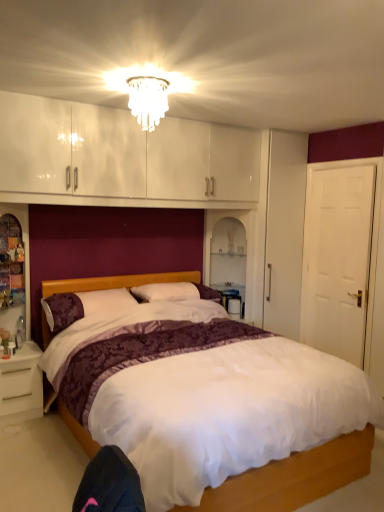
Question: From their relative heights in the image, would you say white glossy table at right is taller or shorter than translucent glass chandelier at upper center?

Choices:
 (A) short
 (B) tall

Answer: (B)

Question: Based on their positions, is white glossy table at right located to the left or right of translucent glass chandelier at upper center?

Choices:
 (A) left
 (B) right

Answer: (B)

Question: Which object is positioned farthest from the translucent glass chandelier at upper center?

Choices:
 (A) white glossy table at right
 (B) white matte door at right
 (C) white glossy nightstand at lower left
 (D) purple floral pillow at center
 (E) white satin bed at center

Answer: (E)

Question: Considering the real-world distances, which object is farthest from the translucent glass chandelier at upper center?

Choices:
 (A) white glossy table at right
 (B) white glossy nightstand at lower left
 (C) purple floral pillow at center
 (D) white matte door at right
 (E) white satin bed at center

Answer: (E)